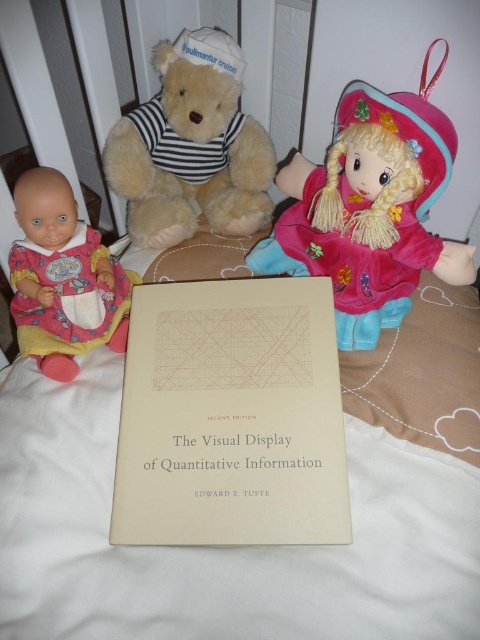
Question: Can you confirm if velvety pink doll at upper right is thinner than matte pink fabric baby doll at left?

Choices:
 (A) no
 (B) yes

Answer: (A)

Question: Does velvety pink doll at upper right appear over matte pink fabric baby doll at left?

Choices:
 (A) yes
 (B) no

Answer: (A)

Question: Can you confirm if velvety pink doll at upper right is positioned to the right of fluffy beige teddy bear at upper center?

Choices:
 (A) no
 (B) yes

Answer: (B)

Question: Which of the following is the farthest from the observer?

Choices:
 (A) matte pink fabric baby doll at left
 (B) beige paper book at center

Answer: (A)

Question: Which point is closer to the camera taking this photo?

Choices:
 (A) (129, 433)
 (B) (224, 188)
 (C) (90, 326)

Answer: (A)

Question: Which object appears closest to the camera in this image?

Choices:
 (A) matte pink fabric baby doll at left
 (B) fluffy beige teddy bear at upper center
 (C) velvety pink doll at upper right

Answer: (C)